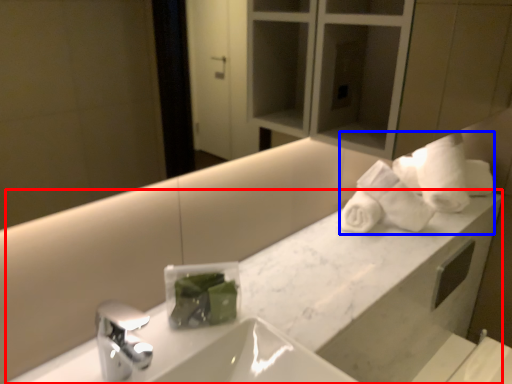
Question: Which point is further to the camera, counter (highlighted by a red box) or bath towel (highlighted by a blue box)?

Choices:
 (A) counter
 (B) bath towel

Answer: (B)